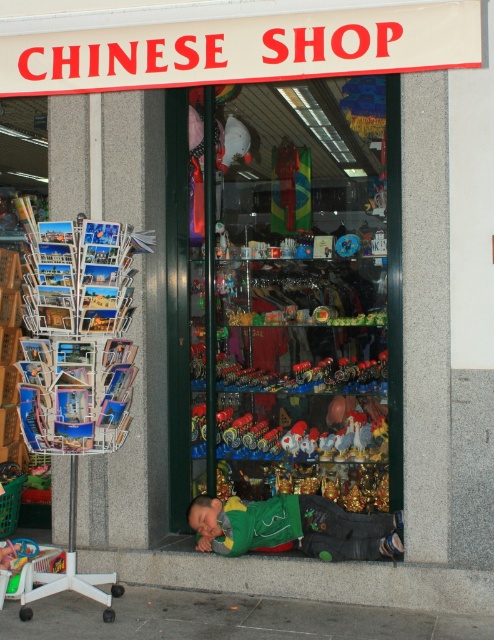
From the picture: You are standing in front of the CHINESE SHOP and notice the gray concrete pavement at lower center and the green fabric sleeping bag at lower center. Which object is lower to the ground?

The gray concrete pavement at lower center has a lesser height compared to the green fabric sleeping bag at lower center, so the gray concrete pavement at lower center is lower to the ground.

You are standing in front of the CHINESE SHOP and want to reach the postcard rack. The postcard rack is located at point (277, 612). If you can walk 5 meters, can you reach it?

The distance between you and the postcard rack at point (277, 612) is 4.37 meters, so yes, you can reach it since your walking distance is sufficient.

You are a delivery person carrying a package that requires placing on the ground. You see the gray concrete pavement at lower center and the green fabric sleeping bag at lower center. Can you place the package between them without moving either object?

The gray concrete pavement at lower center and the green fabric sleeping bag at lower center are 19.03 inches apart from each other. Since the distance between them is sufficient, you can place the package between them without moving either object.